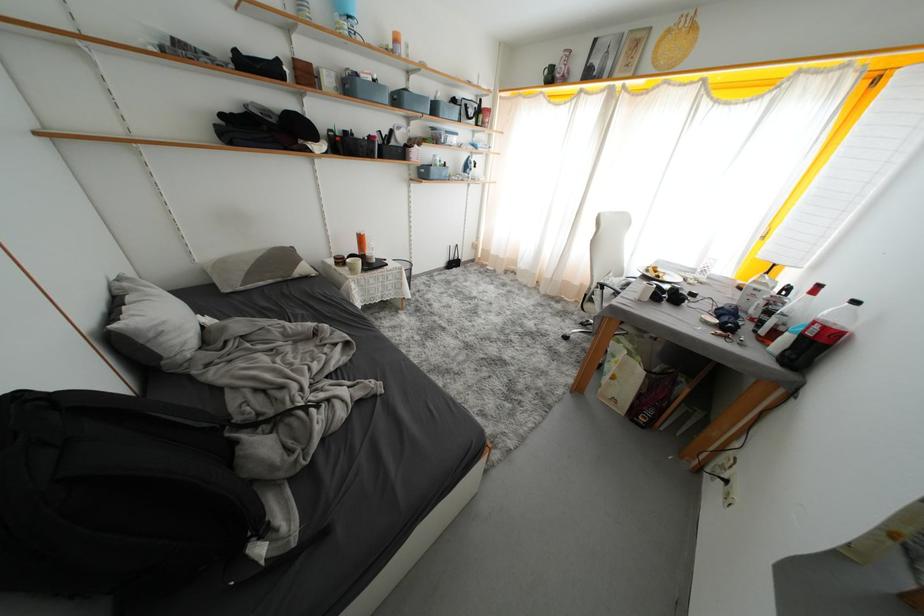
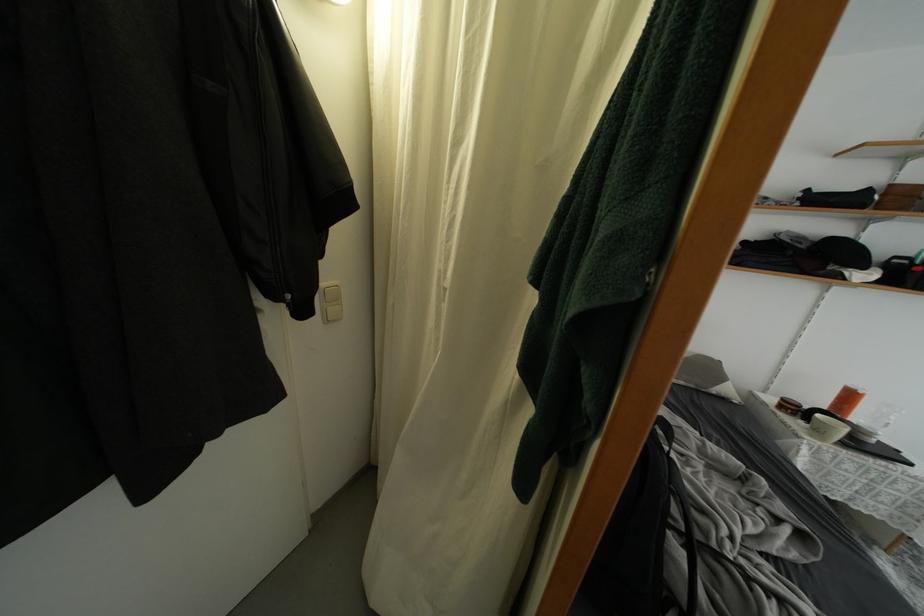
The point at (368,243) is marked in the first image. Where is the corresponding point in the second image?

(856, 400)